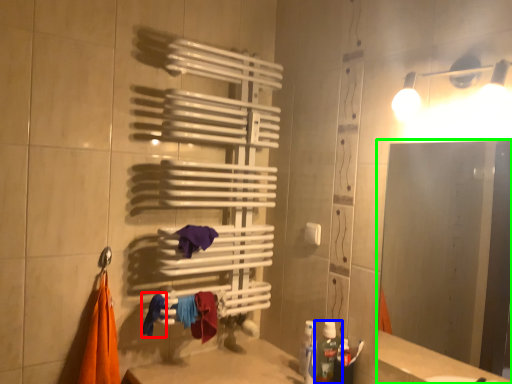
Question: Which object is the closest to the clothe (highlighted by a red box)? Choose among these: bottle (highlighted by a blue box) or mirror (highlighted by a green box).

Choices:
 (A) bottle
 (B) mirror

Answer: (A)